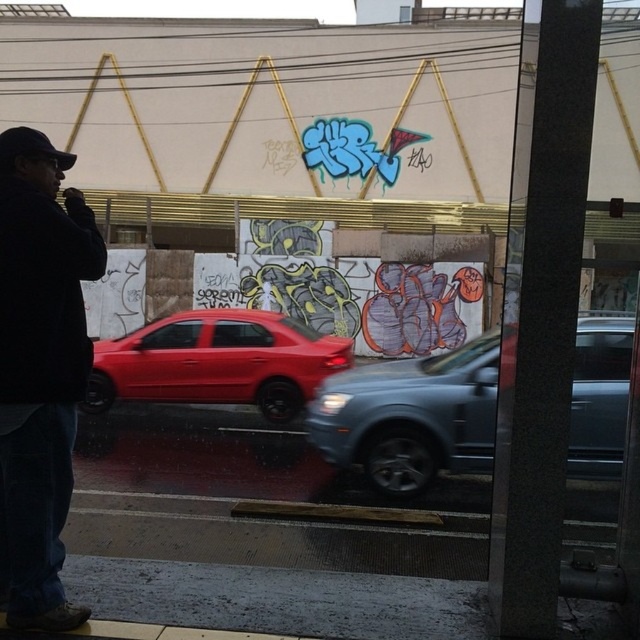
You are standing at the point labeled point (26, 225) and want to walk to the point labeled point (580, 465). Is there a clear path between these two points without obstacles?

Yes, there is a clear path between point (26, 225) and point (580, 465) since the first point is in front of the second, indicating no obstruction between them.

Consider the image. You are a pedestrian standing at the edge of the street. You see a dark blue jacket at left and a glossy red car at center. Which object is closer to you?

The dark blue jacket at left is closer to you because it has a smaller size compared to the glossy red car at center, which is farther away.